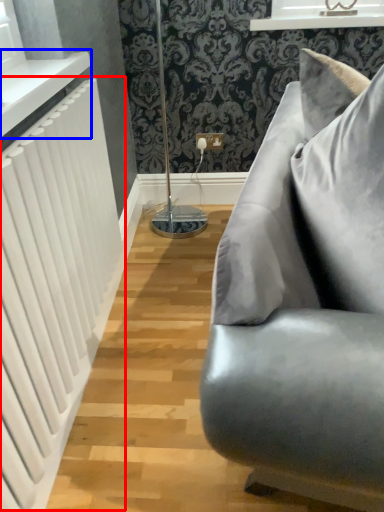
Question: Which object is closer to the camera taking this photo, radiator (highlighted by a red box) or window sill (highlighted by a blue box)?

Choices:
 (A) radiator
 (B) window sill

Answer: (A)